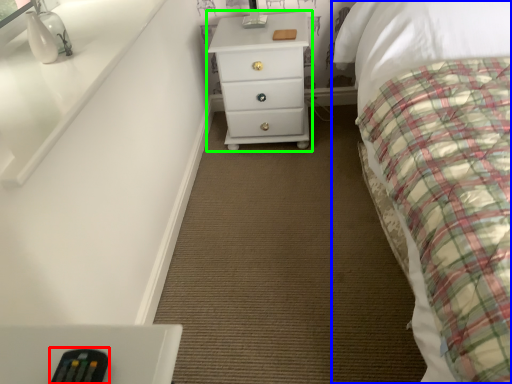
Question: Which object is the farthest from remote (highlighted by a red box)? Choose among these: bed (highlighted by a blue box) or chest of drawers (highlighted by a green box).

Choices:
 (A) bed
 (B) chest of drawers

Answer: (B)